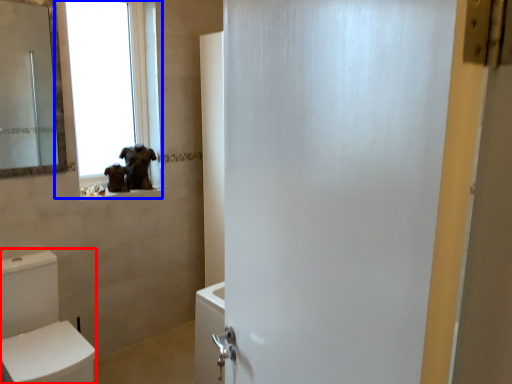
Question: Among these objects, which one is nearest to the camera, toilet bowl (highlighted by a red box) or window (highlighted by a blue box)?

Choices:
 (A) toilet bowl
 (B) window

Answer: (A)